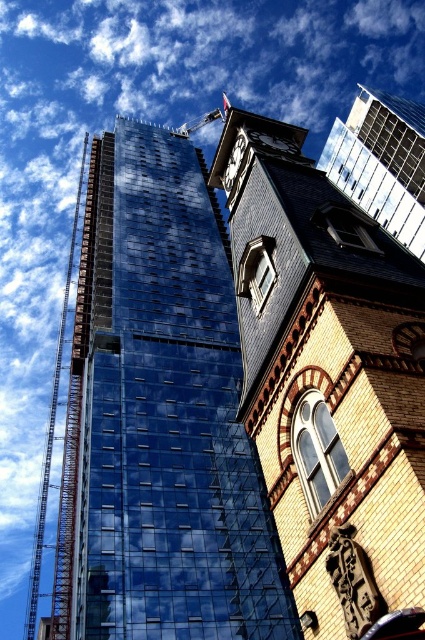
You are standing in the middle of the street looking at the shiny glass building at center and the black metal clock at upper center. Which object is positioned higher in the image?

The black metal clock at upper center is positioned higher than the shiny glass building at center in the image.

You are an architect observing the image and want to ensure that the yellow brick clock tower at upper center does not block the view of the polished brass clock at upper center from the street below. Based on their positions, is this possible?

The yellow brick clock tower at upper center is positioned under the polished brass clock at upper center, so the clock is above the tower. This means the polished brass clock at upper center should be visible from the street below without obstruction from the tower.